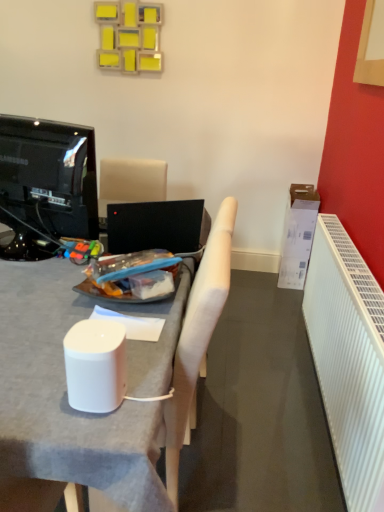
Where is `free location above white cardboard box at right (from a real-world perspective)`? free location above white cardboard box at right (from a real-world perspective) is located at coordinates [301, 188].